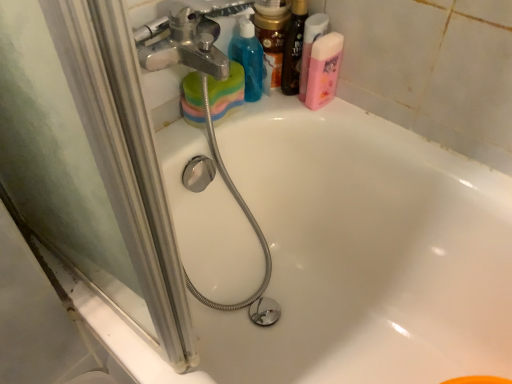
Question: From a real-world perspective, relative to shiny black bottle at upper right, which is the second toiletry in left-to-right order, is shiny gold jar at upper center, which ranks as the first toiletry in left-to-right order, vertically above or below?

Choices:
 (A) above
 (B) below

Answer: (A)

Question: Is shiny gold jar at upper center, which ranks as the first toiletry in left-to-right order, bigger or smaller than shiny black bottle at upper right, which is the second toiletry in left-to-right order?

Choices:
 (A) big
 (B) small

Answer: (A)

Question: Considering the real-world distances, which object is farthest from the white glossy bathtub at upper center?

Choices:
 (A) pink matte shaving cream at upper right
 (B) translucent blue plastic bottle at upper center, arranged as the first cleaning product when viewed from the left
 (C) shiny black bottle at upper right, the 1th toiletry in the right-to-left sequence
 (D) pink matte bottle at upper right, arranged as the 1th cleaning product when viewed from the right
 (E) shiny gold jar at upper center, acting as the 2th toiletry starting from the right

Answer: (E)

Question: Which object is positioned closest to the pink matte bottle at upper right, which appears as the second cleaning product when viewed from the left?

Choices:
 (A) shiny black bottle at upper right, which is the second toiletry in left-to-right order
 (B) shiny gold jar at upper center, which ranks as the first toiletry in left-to-right order
 (C) pink matte shaving cream at upper right
 (D) white glossy bathtub at upper center
 (E) translucent blue plastic bottle at upper center, positioned as the 2th cleaning product in right-to-left order

Answer: (C)